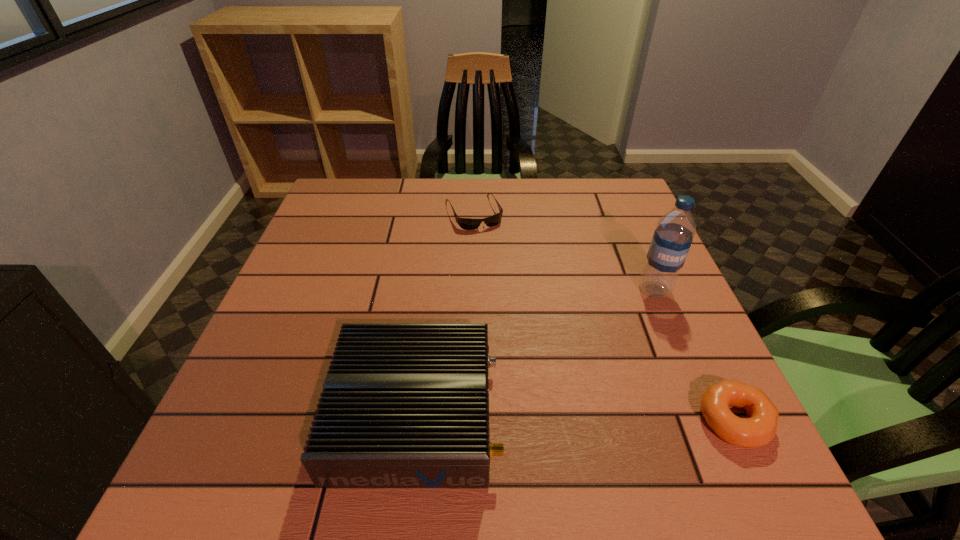
You are a GUI agent. You are given a task and a screenshot of the screen. Output one action in this format:
    pyautogui.click(x=<x>, y=<y>)
    Task: Click on the vacant space located 0.390m on the front-facing side of the sunglasses
    The height and width of the screenshot is (540, 960).
    Given the screenshot: What is the action you would take?
    pyautogui.click(x=535, y=338)

The width and height of the screenshot is (960, 540). Identify the location of vacant space situated 0.330m on the label of the third nearest object. (610, 417).

Image resolution: width=960 pixels, height=540 pixels. I want to click on vacant space situated on the label of the third nearest object, so click(616, 400).

Identify the location of free space located 0.350m on the label of the third nearest object. The image size is (960, 540). (607, 427).

Where is `object present at the far edge`? The image size is (960, 540). object present at the far edge is located at coordinates (465, 223).

Locate an element on the screen. This screenshot has width=960, height=540. router that is at the near edge is located at coordinates (404, 405).

The image size is (960, 540). What are the coordinates of `doughnut that is at the near edge` in the screenshot? It's located at (758, 430).

I want to click on doughnut that is at the right edge, so [758, 430].

This screenshot has height=540, width=960. I want to click on water bottle that is at the right edge, so click(673, 236).

Locate an element on the screen. The image size is (960, 540). object that is at the near right corner is located at coordinates (758, 430).